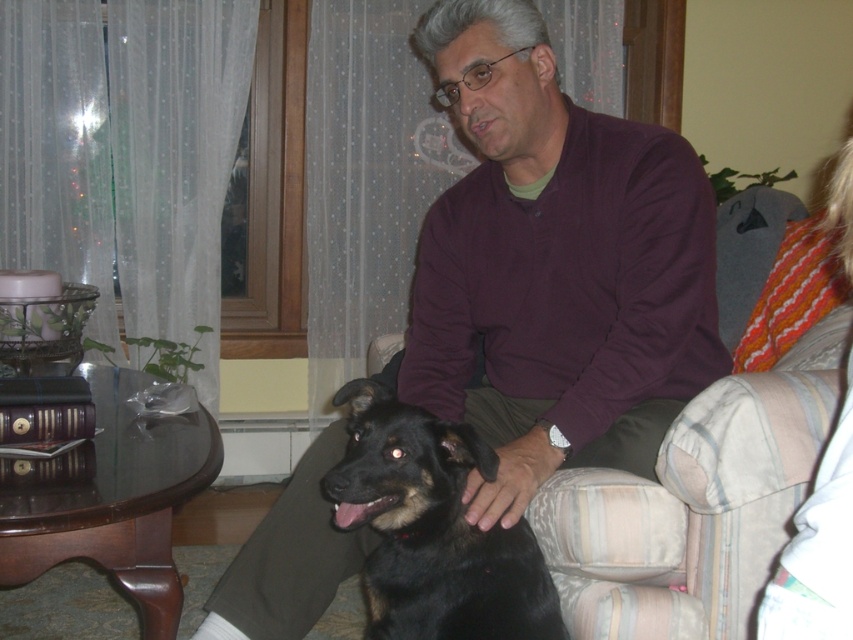
Question: Does maroon sweater at center have a lesser width compared to black fur dog at center?

Choices:
 (A) yes
 (B) no

Answer: (B)

Question: Which object is closer to the camera taking this photo?

Choices:
 (A) maroon sweater at center
 (B) black fur dog at center

Answer: (B)

Question: Does maroon sweater at center have a larger size compared to black fur dog at center?

Choices:
 (A) yes
 (B) no

Answer: (A)

Question: From the image, what is the correct spatial relationship of maroon sweater at center in relation to black fur dog at center?

Choices:
 (A) right
 (B) left

Answer: (A)